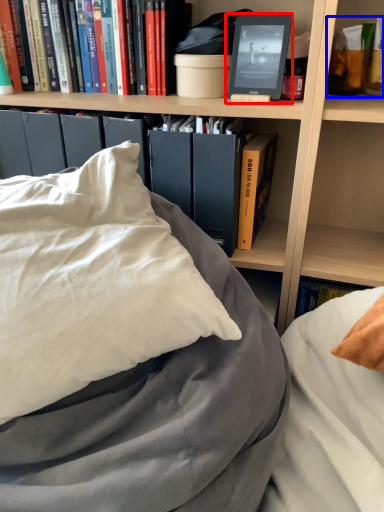
Question: Which point is further to the camera, paperback book (highlighted by a red box) or book (highlighted by a blue box)?

Choices:
 (A) paperback book
 (B) book

Answer: (B)